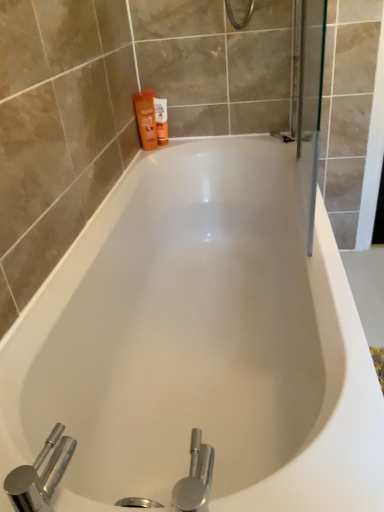
I want to click on vacant region to the right of orange matte lotion at upper left, which ranks as the second toiletry in left-to-right order, so point(200,143).